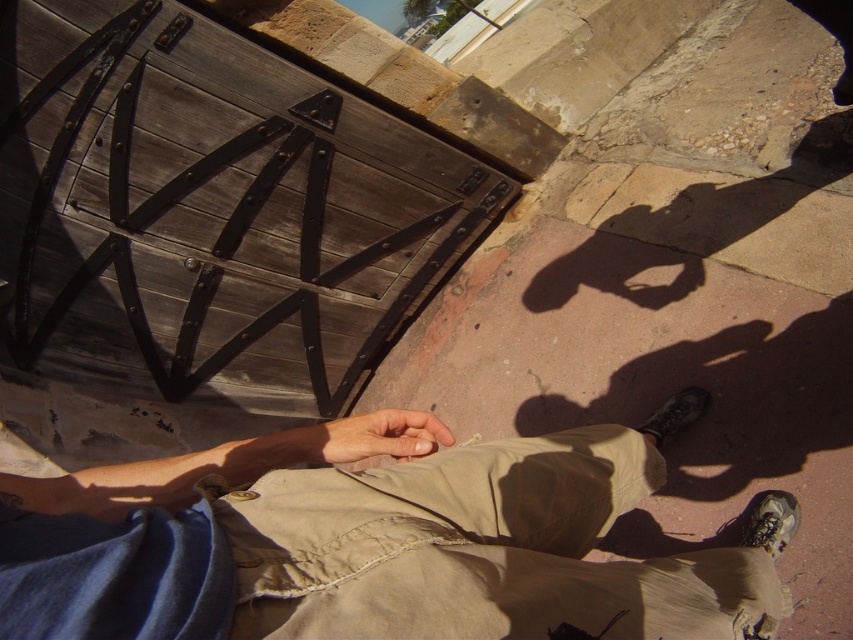
You are a security camera observing the scene. You see the khaki cotton pants at lower center and the light brown leather hand at center. Which object is closer to the camera?

The khaki cotton pants at lower center is in front of the light brown leather hand at center, so the khaki cotton pants at lower center is closer to the camera.

You are a fashion designer analyzing the image. You need to determine which item has a larger size between the khaki cotton pants at lower center and the matte gray shoe at lower right. Which one is bigger?

The khaki cotton pants at lower center is bigger than the matte gray shoe at lower right according to the description.

You are a fashion designer observing the image. You need to decide whether the khaki cotton pants at lower center can comfortably accommodate the light brown leather hand at center. Based on the spatial relationship between them, can the hand fit into the pants?

The khaki cotton pants at lower center might be wider than light brown leather hand at center, so there is a possibility that the hand can fit into the pants if the width difference allows it. However, without exact measurements, this is speculative.